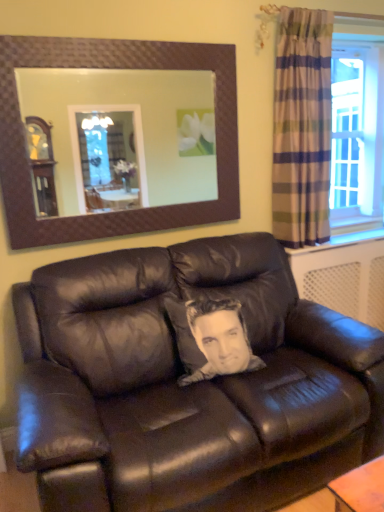
Measure the distance between plaid fabric curtain at right and camera.

A distance of 7.41 feet exists between plaid fabric curtain at right and camera.

This screenshot has width=384, height=512. What do you see at coordinates (189, 386) in the screenshot? I see `matte black leather couch at center` at bounding box center [189, 386].

You are a GUI agent. You are given a task and a screenshot of the screen. Output one action in this format:
    pyautogui.click(x=<x>, y=<y>)
    Task: Click on the brown textured mirror at upper center
    
    Given the screenshot: What is the action you would take?
    pyautogui.click(x=122, y=135)

Where is `curtain behind the matte black leather couch at center`? curtain behind the matte black leather couch at center is located at coordinates (302, 127).

Does matte black leather couch at center lie behind plaid fabric curtain at right?

No, matte black leather couch at center is closer to the camera.

Considering the positions of point (74, 365) and point (281, 142), is point (74, 365) closer or farther from the camera than point (281, 142)?

Point (74, 365) is positioned closer to the camera compared to point (281, 142).

Is brown textured mirror at upper center facing towards matte black leather couch at center?

No, brown textured mirror at upper center is not turned towards matte black leather couch at center.

Does brown textured mirror at upper center have a greater height compared to matte black leather couch at center?

No.

Is brown textured mirror at upper center directly adjacent to matte black leather couch at center?

brown textured mirror at upper center and matte black leather couch at center are not in contact.

Visually, is brown textured mirror at upper center positioned to the left or to the right of matte black leather couch at center?

Clearly, brown textured mirror at upper center is on the left of matte black leather couch at center in the image.

Based on the photo, which object is positioned more to the right, plaid fabric curtain at right or brown textured mirror at upper center?

plaid fabric curtain at right.

Does plaid fabric curtain at right have a lesser width compared to brown textured mirror at upper center?

No.

Where is `curtain behind the brown textured mirror at upper center`? The image size is (384, 512). curtain behind the brown textured mirror at upper center is located at coordinates click(x=302, y=127).

How many degrees apart are the facing directions of plaid fabric curtain at right and brown textured mirror at upper center?

The facing directions of plaid fabric curtain at right and brown textured mirror at upper center are 1.6 degrees apart.

Looking at this image, from the image's perspective, is plaid fabric curtain at right above or below matte black leather couch at center?

Based on their image positions, plaid fabric curtain at right is located above matte black leather couch at center.

Which is farther, [305,151] or [73,273]?

The point [305,151] is behind.

Locate an element on the screen. curtain that is above the matte black leather couch at center (from a real-world perspective) is located at coordinates (302, 127).

Is brown textured mirror at upper center smaller than plaid fabric curtain at right?

Indeed, brown textured mirror at upper center has a smaller size compared to plaid fabric curtain at right.

From the picture: From a real-world perspective, is brown textured mirror at upper center physically located above or below plaid fabric curtain at right?

Clearly, from a real-world perspective, brown textured mirror at upper center is above plaid fabric curtain at right.

Is brown textured mirror at upper center directly adjacent to plaid fabric curtain at right?

brown textured mirror at upper center and plaid fabric curtain at right are clearly separated.

From the image's perspective, is brown textured mirror at upper center above or below plaid fabric curtain at right?

brown textured mirror at upper center is below plaid fabric curtain at right.

Considering the relative sizes of matte black leather couch at center and brown textured mirror at upper center in the image provided, is matte black leather couch at center wider than brown textured mirror at upper center?

Indeed, matte black leather couch at center has a greater width compared to brown textured mirror at upper center.

Does matte black leather couch at center have a smaller size compared to brown textured mirror at upper center?

No.

Is point (173, 263) closer or farther from the camera than point (58, 178)?

Point (173, 263) appears to be closer to the viewer than point (58, 178).

Is matte black leather couch at center with brown textured mirror at upper center?

No, matte black leather couch at center is not next to brown textured mirror at upper center.

Locate an element on the screen. This screenshot has height=512, width=384. studio couch beneath the plaid fabric curtain at right (from a real-world perspective) is located at coordinates (189, 386).

Where is `studio couch on the right of brown textured mirror at upper center`? The height and width of the screenshot is (512, 384). studio couch on the right of brown textured mirror at upper center is located at coordinates (189, 386).

Looking at the image, which one is located further to matte black leather couch at center, brown textured mirror at upper center or plaid fabric curtain at right?

Among the two, brown textured mirror at upper center is located further to matte black leather couch at center.

Considering their positions, is brown textured mirror at upper center positioned further to plaid fabric curtain at right than matte black leather couch at center?

brown textured mirror at upper center is positioned further to the anchor plaid fabric curtain at right.

Considering their positions, is matte black leather couch at center positioned further to brown textured mirror at upper center than plaid fabric curtain at right?

Based on the image, matte black leather couch at center appears to be further to brown textured mirror at upper center.

Looking at the image, which one is located closer to matte black leather couch at center, plaid fabric curtain at right or brown textured mirror at upper center?

plaid fabric curtain at right is positioned closer to the anchor matte black leather couch at center.

Consider the image. From the image, which object appears to be nearer to plaid fabric curtain at right, matte black leather couch at center or brown textured mirror at upper center?

matte black leather couch at center lies closer to plaid fabric curtain at right than the other object.

From the image, which object appears to be nearer to brown textured mirror at upper center, plaid fabric curtain at right or matte black leather couch at center?

plaid fabric curtain at right.

Find the location of a particular element. Image resolution: width=384 pixels, height=512 pixels. mirror between plaid fabric curtain at right and matte black leather couch at center vertically is located at coordinates (122, 135).